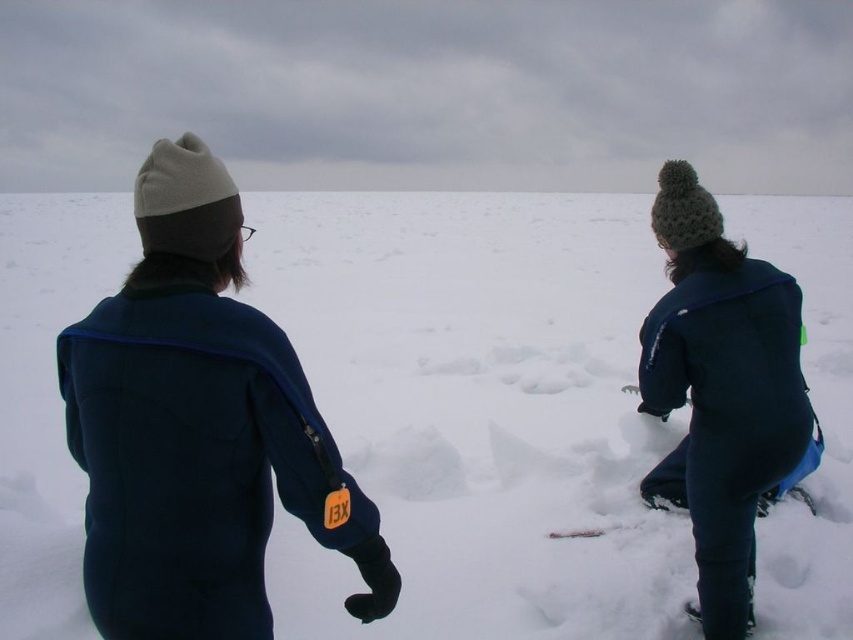
You are standing at the point marked as point (198, 428) in the snowy landscape. Which object is located exactly at this point?

The dark blue fleece jacket at upper left is located exactly at point (198, 428).

You are a photographer trying to capture the dark blue fleece jacket at right and the white fluffy snow at center. Which object is located to the right of the other?

The white fluffy snow at center is positioned on the right side of dark blue fleece jacket at right.

You are a photographer trying to capture a clear shot of the dark blue fleece jacket at right. However, the white fluffy snow at center is blocking your view. Can you adjust your angle to see the jacket without moving the snow?

The white fluffy snow at center is positioned over the dark blue fleece jacket at right, so if you lower your camera angle or move slightly to the side, you should be able to see the jacket underneath the snow without disturbing it.